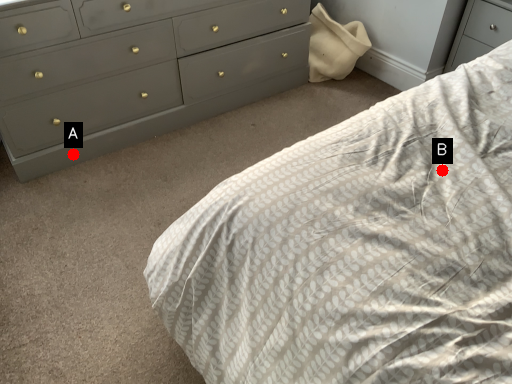
Question: Two points are circled on the image, labeled by A and B beside each circle. Which point is closer to the camera taking this photo?

Choices:
 (A) A is closer
 (B) B is closer

Answer: (B)